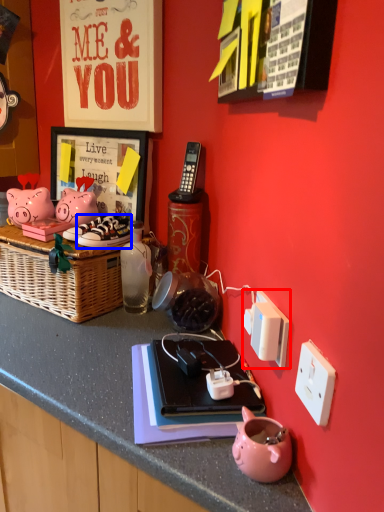
Question: Which object appears closest to the camera in this image, power plugs and sockets (highlighted by a red box) or footwear (highlighted by a blue box)?

Choices:
 (A) power plugs and sockets
 (B) footwear

Answer: (A)